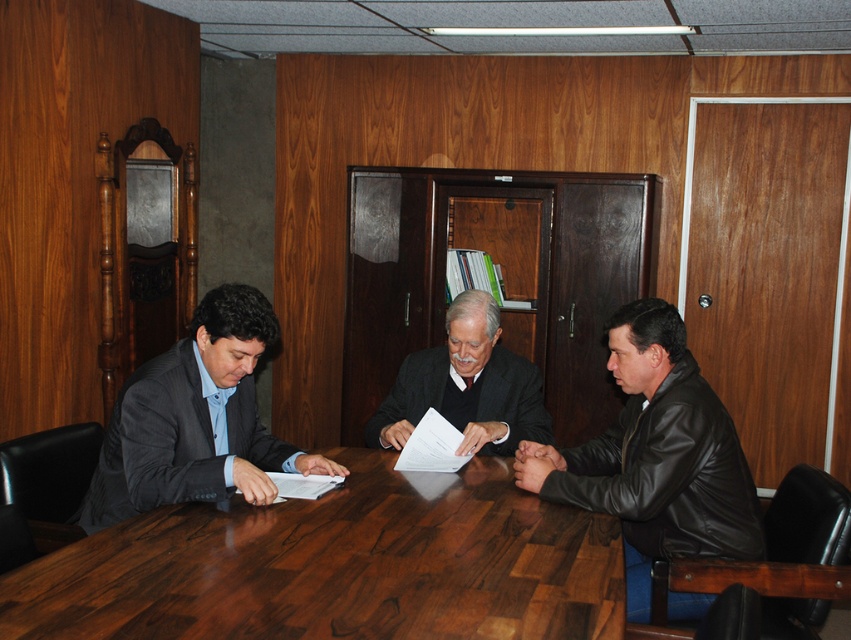
Who is positioned more to the right, black leather jacket at lower right or matte gray suit at left?

Positioned to the right is black leather jacket at lower right.

Does black leather jacket at lower right have a greater width compared to matte gray suit at left?

Incorrect, black leather jacket at lower right's width does not surpass matte gray suit at left's.

Is point (635, 300) positioned before point (143, 371)?

No, it is not.

At what (x,y) coordinates should I click in order to perform the action: click on black leather jacket at lower right. Please return your answer as a coordinate pair (x, y). The height and width of the screenshot is (640, 851). Looking at the image, I should click on (655, 456).

Does matte gray suit at left have a larger size compared to white paper at center?

Correct, matte gray suit at left is larger in size than white paper at center.

Does matte gray suit at left appear on the right side of white paper at center?

No, matte gray suit at left is not to the right of white paper at center.

Identify the location of matte gray suit at left. This screenshot has width=851, height=640. (195, 419).

Is point (644, 433) farther from viewer compared to point (457, 456)?

That is False.

Can you confirm if black leather jacket at lower right is positioned to the right of white paper at center?

Indeed, black leather jacket at lower right is positioned on the right side of white paper at center.

What do you see at coordinates (655, 456) in the screenshot?
I see `black leather jacket at lower right` at bounding box center [655, 456].

You are a GUI agent. You are given a task and a screenshot of the screen. Output one action in this format:
    pyautogui.click(x=<x>, y=<y>)
    Task: Click on the black leather jacket at lower right
    
    Given the screenshot: What is the action you would take?
    pyautogui.click(x=655, y=456)